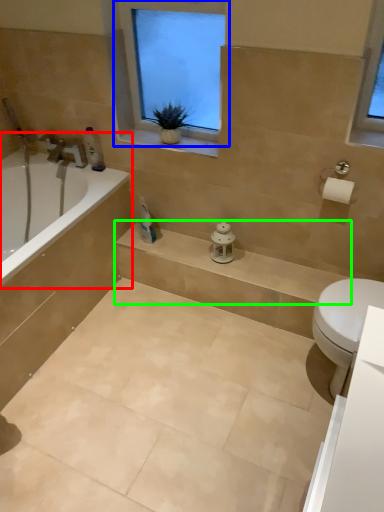
Question: Which is farther away from bathtub (highlighted by a red box)? window (highlighted by a blue box) or balustrade (highlighted by a green box)?

Choices:
 (A) window
 (B) balustrade

Answer: (A)